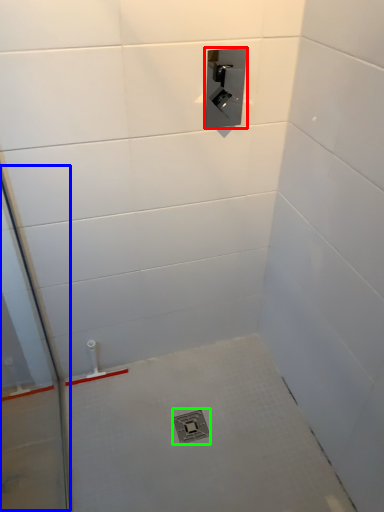
Question: Which object is the closest to the plumbing fixture (highlighted by a red box)? Choose among these: glass door (highlighted by a blue box) or drain (highlighted by a green box).

Choices:
 (A) glass door
 (B) drain

Answer: (A)